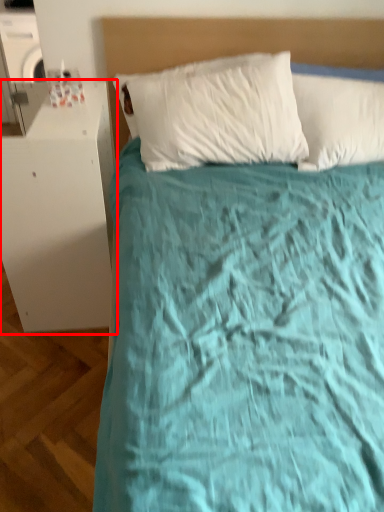
Question: From the image, what is the correct spatial relationship of table (annotated by the red box) in relation to headboard?

Choices:
 (A) left
 (B) right

Answer: (A)